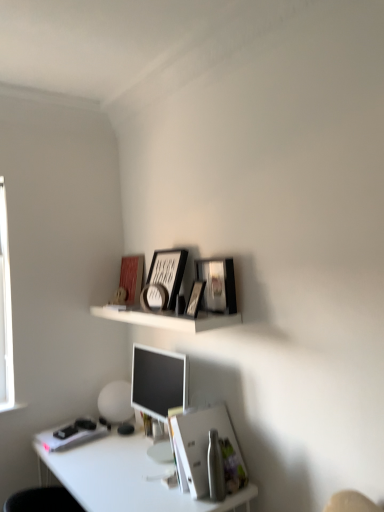
This screenshot has width=384, height=512. Find the location of `free location to the right of white matte book at lower left`. free location to the right of white matte book at lower left is located at coordinates pos(115,443).